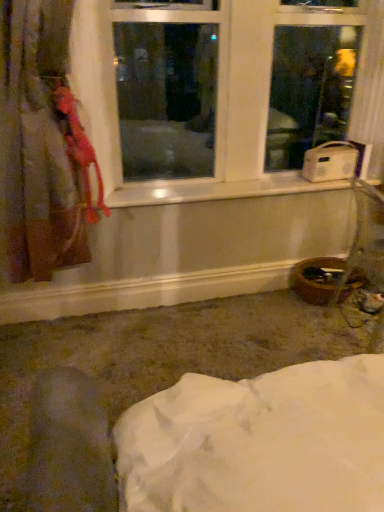
You are a GUI agent. You are given a task and a screenshot of the screen. Output one action in this format:
    pyautogui.click(x=<x>, y=<y>)
    Task: Click on the free space above white plastic window sill at center (from a real-world perspective)
    Image resolution: width=384 pixels, height=512 pixels.
    Given the screenshot: What is the action you would take?
    pyautogui.click(x=239, y=186)